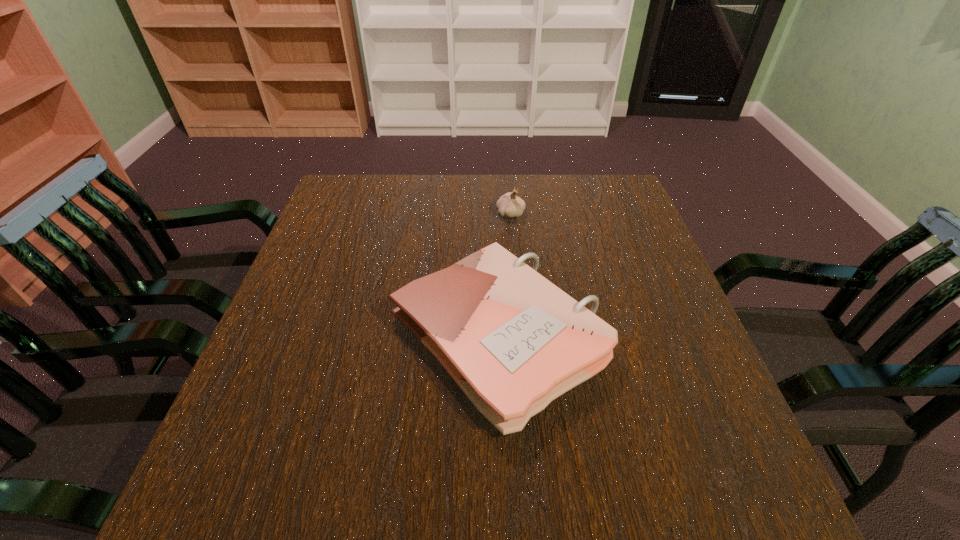
At what (x,y) coordinates should I click in order to perform the action: click on free point that satisfies the following two spatial constraints: 1. on the back side of the garlic; 2. on the left side of the phonebook. Please return your answer as a coordinate pair (x, y). Image resolution: width=960 pixels, height=540 pixels. Looking at the image, I should click on (492, 214).

Where is `free spot that satisfies the following two spatial constraints: 1. on the back side of the farther object; 2. on the right side of the nearer object`? This screenshot has height=540, width=960. free spot that satisfies the following two spatial constraints: 1. on the back side of the farther object; 2. on the right side of the nearer object is located at coordinates (492, 214).

Identify the location of vacant position in the image that satisfies the following two spatial constraints: 1. on the back side of the farther object; 2. on the right side of the nearer object. The width and height of the screenshot is (960, 540). (492, 214).